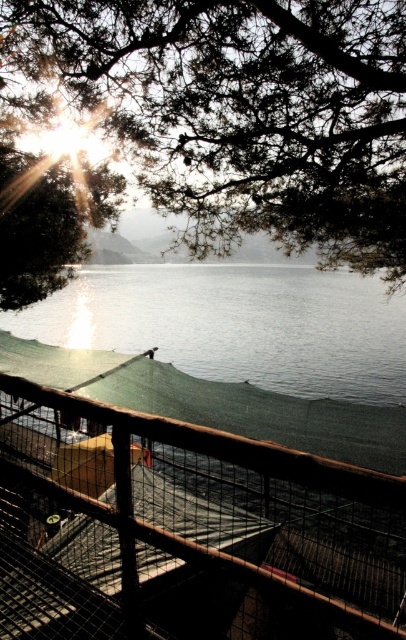
Question: Among these points, which one is farthest from the camera?

Choices:
 (A) (267, 51)
 (B) (332, 504)

Answer: (B)

Question: Does brown wooden fence at lower center have a greater width compared to green leafy tree at upper center?

Choices:
 (A) no
 (B) yes

Answer: (B)

Question: Is brown wooden fence at lower center closer to the viewer compared to green leafy tree at upper center?

Choices:
 (A) yes
 (B) no

Answer: (A)

Question: Does brown wooden fence at lower center have a larger size compared to green leafy tree at upper center?

Choices:
 (A) no
 (B) yes

Answer: (B)

Question: Which point is closer to the camera?

Choices:
 (A) green leafy tree at upper center
 (B) brown wooden fence at lower center

Answer: (B)